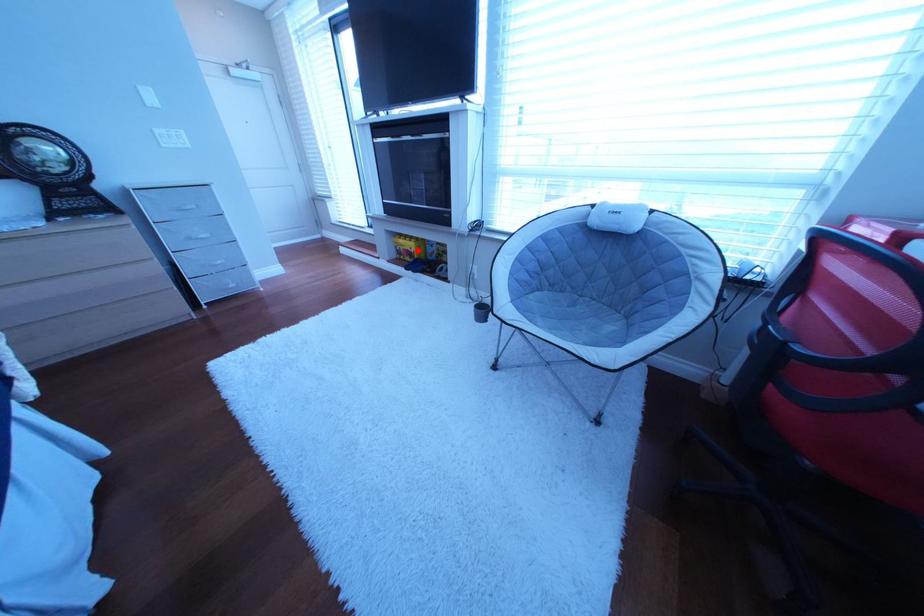
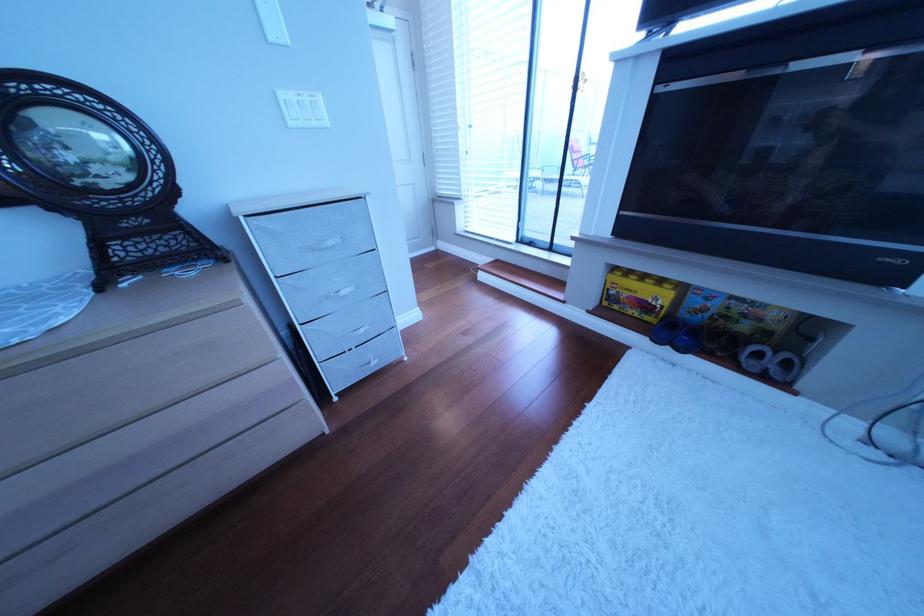
In the second image, find the point that corresponds to the highlighted location in the first image.

(640, 296)